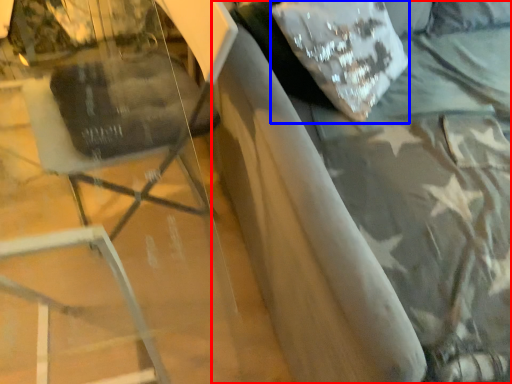
Question: Which object appears closest to the camera in this image, bed (highlighted by a red box) or pillow (highlighted by a blue box)?

Choices:
 (A) bed
 (B) pillow

Answer: (A)